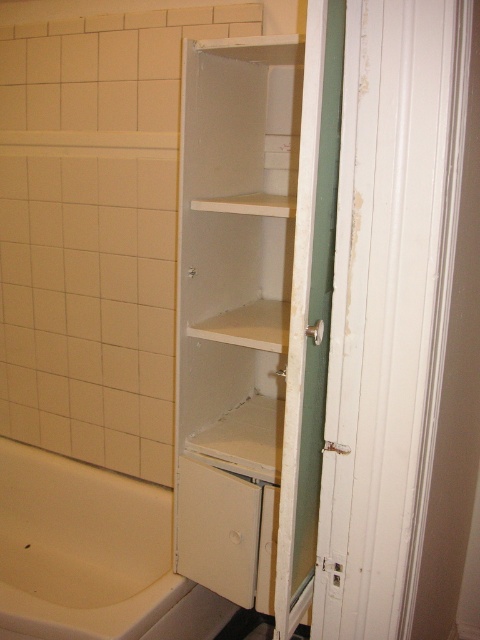
You are standing in front of the bathroom cabinet and need to reach two points marked on the wall. The first point is at coordinates point (36, 454) and the second is at point (268, 348). Which point is closer to you?

Point (36, 454) is further to the viewer than point (268, 348), so the second point is closer to you.

You are a contractor assessing bathroom renovations. You need to install a new faucet that requires a minimum height clearance of 1.2 meters. Given the white glossy bathtub at lower left and the white matte shelf at center, which object do you think meets the height requirement?

The white glossy bathtub at lower left is much taller than the white matte shelf at center, so the bathtub likely meets the height requirement of 1.2 meters.

In the scene shown: You are standing in the bathroom and want to reach the point at coordinates point (x=348, y=371). You have a 3.5 feet long pole. Can you reach that point with the pole?

The distance between you and the point (x=348, y=371) is 3.95 feet. Since your pole is 3.5 feet long, which is shorter than the required distance, you cannot reach the point with the pole.